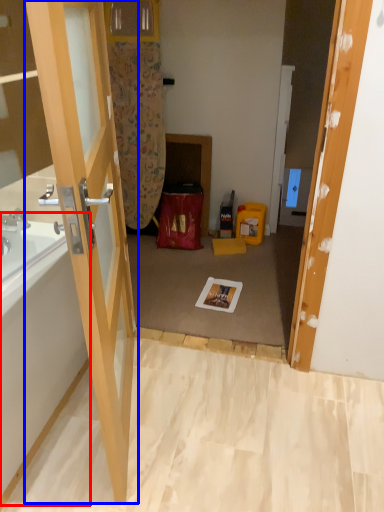
Question: Among these objects, which one is farthest to the camera, bath (highlighted by a red box) or door (highlighted by a blue box)?

Choices:
 (A) bath
 (B) door

Answer: (A)